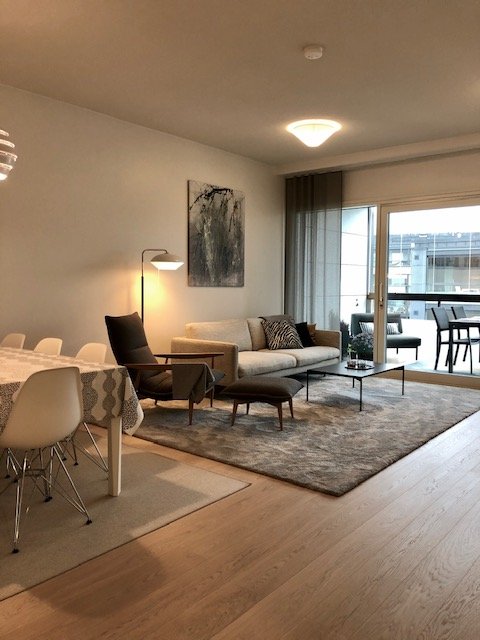
In order to click on gray curtain in this screenshot , I will do (x=294, y=253).